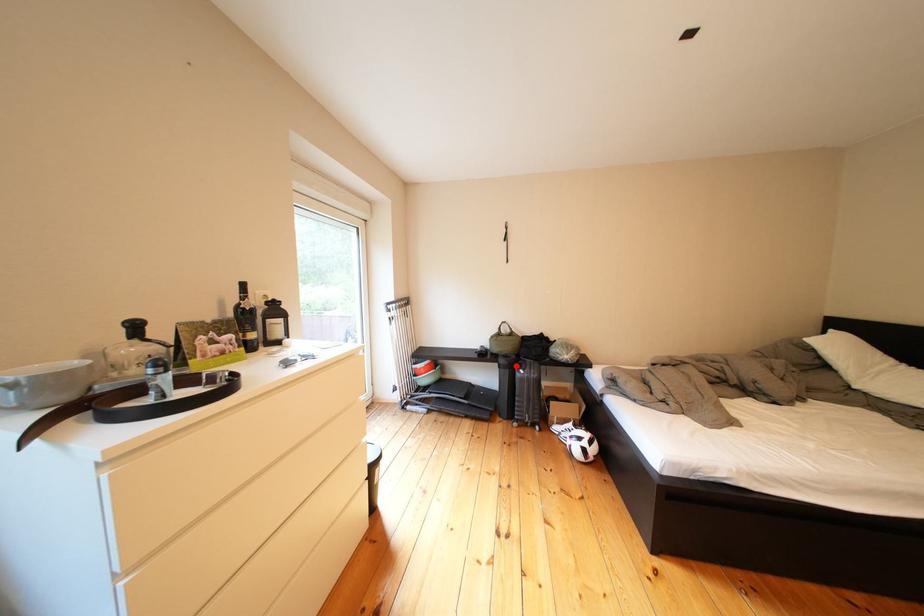
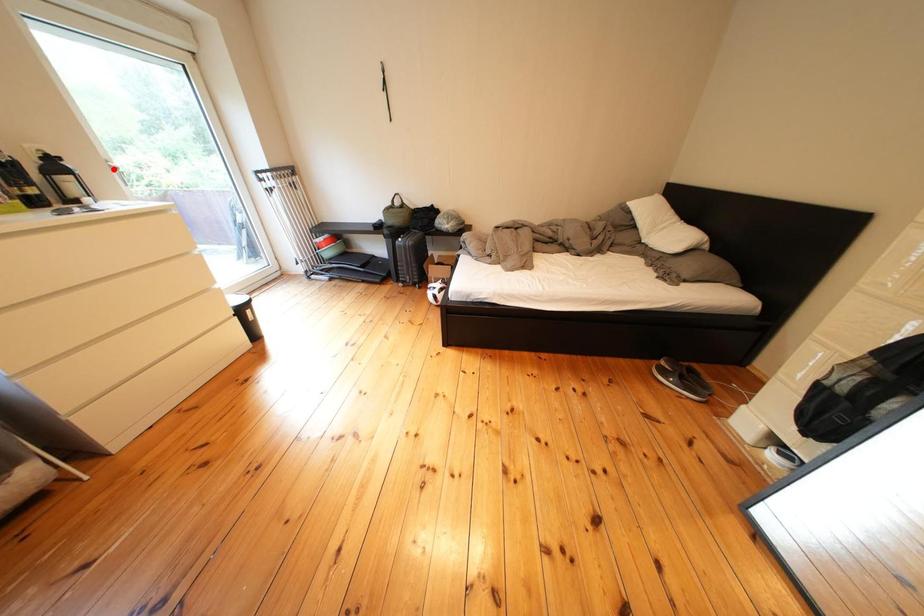
I am providing you with two images of the same scene from different viewpoints. A red point is marked on the first image and another point is marked on the second image. Are the points marked in image1 and image2 representing the same 3D position?

No